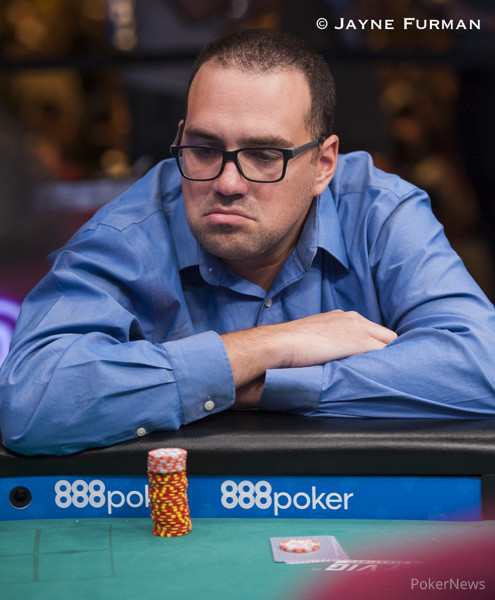
Find the location of a particular element. This screenshot has height=600, width=495. counter is located at coordinates (327, 439).